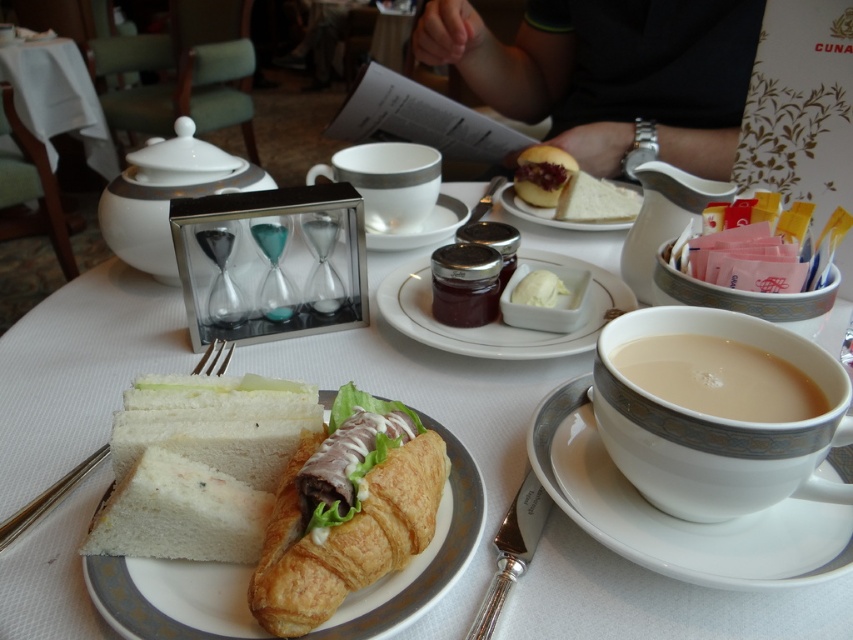
You are a server in a restaurant and need to place a taller object between the white porcelain cup at upper center and the white bread at upper center. Which object should you move to make space?

The white porcelain cup at upper center is taller than the white bread at upper center. To place a taller object between them, you should move the white bread at upper center since the cup is already taller and occupies the vertical space.

You are a server in a restaurant and need to place a 30 cm long platter between the white porcelain cup at upper center and the white bread at upper center on the table. Can you fit it there?

The distance between the white porcelain cup at upper center and the white bread at upper center is 28.80 centimeters. Since the platter is 30 cm long, it cannot fit in the available space.

You are a customer at this cafe and want to reach the point at coordinates (125,273). The server says you can only move items that are closer than 25 inches. Can you move the items at that point?

The point at coordinates (125,273) is 24.35 inches from the viewer, which is within the 25 inches limit. Therefore, you can move the items at that point.